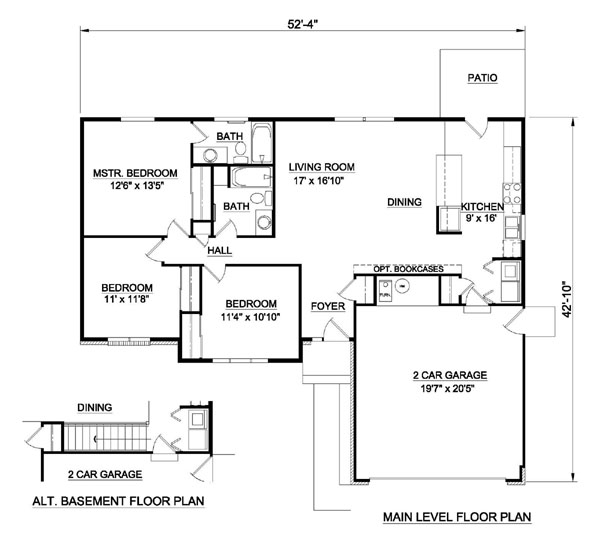
The height and width of the screenshot is (544, 600). Find the location of `second bathroom`. second bathroom is located at coordinates (228, 193).